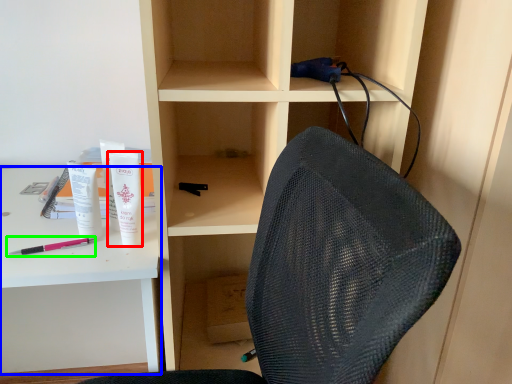
Question: Based on their relative distances, which object is nearer to toiletry (highlighted by a red box)? Choose from desk (highlighted by a blue box) and pencil (highlighted by a green box).

Choices:
 (A) desk
 (B) pencil

Answer: (B)